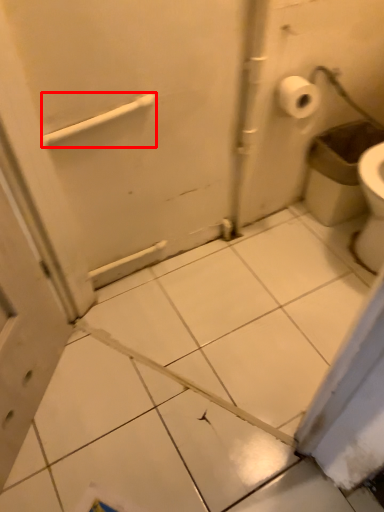
Question: From the image's perspective, what is the correct spatial relationship of towel bar (annotated by the red box) in relation to garbage?

Choices:
 (A) below
 (B) above

Answer: (B)